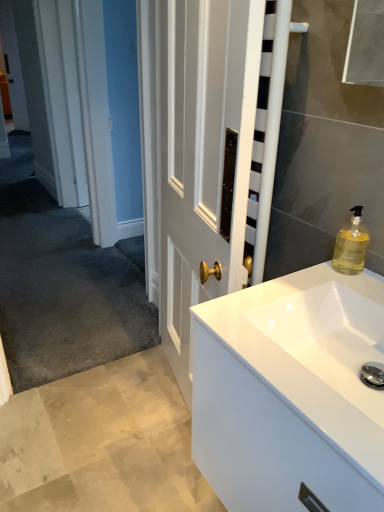
Find the location of a particular element. The image size is (384, 512). free location in front of translucent yellow liquid at upper right is located at coordinates (350, 285).